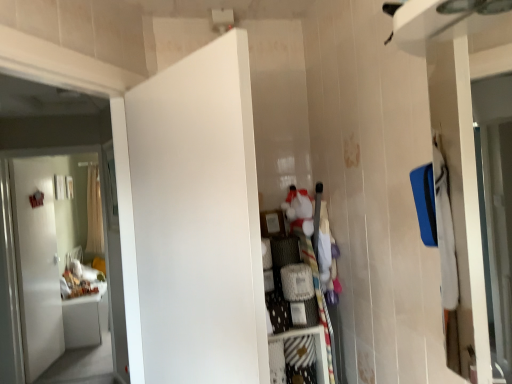
Question: Considering the positions of white matte door at left, marked as the 1th door in a left-to-right arrangement, and white fabric dresser at center in the image, is white matte door at left, marked as the 1th door in a left-to-right arrangement, bigger or smaller than white fabric dresser at center?

Choices:
 (A) big
 (B) small

Answer: (A)

Question: Considering the positions of point (56, 347) and point (305, 223), is point (56, 347) closer or farther from the camera than point (305, 223)?

Choices:
 (A) closer
 (B) farther

Answer: (B)

Question: Based on their relative distances, which object is nearer to the white sheer curtain at left?

Choices:
 (A) white matte door at left, marked as the 2th door in a front-to-back arrangement
 (B) white matte door at center, acting as the 1th door starting from the front
 (C) white fabric dresser at center

Answer: (A)

Question: Which object is positioned farthest from the white matte door at center, which is counted as the second door, starting from the left?

Choices:
 (A) white fabric dresser at center
 (B) white sheer curtain at left
 (C) white matte door at left, marked as the 1th door in a left-to-right arrangement

Answer: (B)